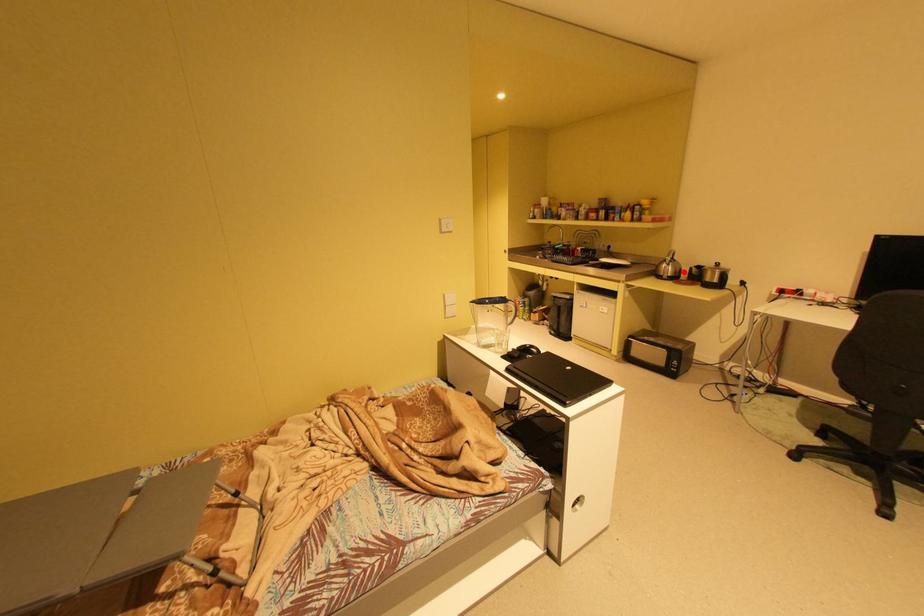
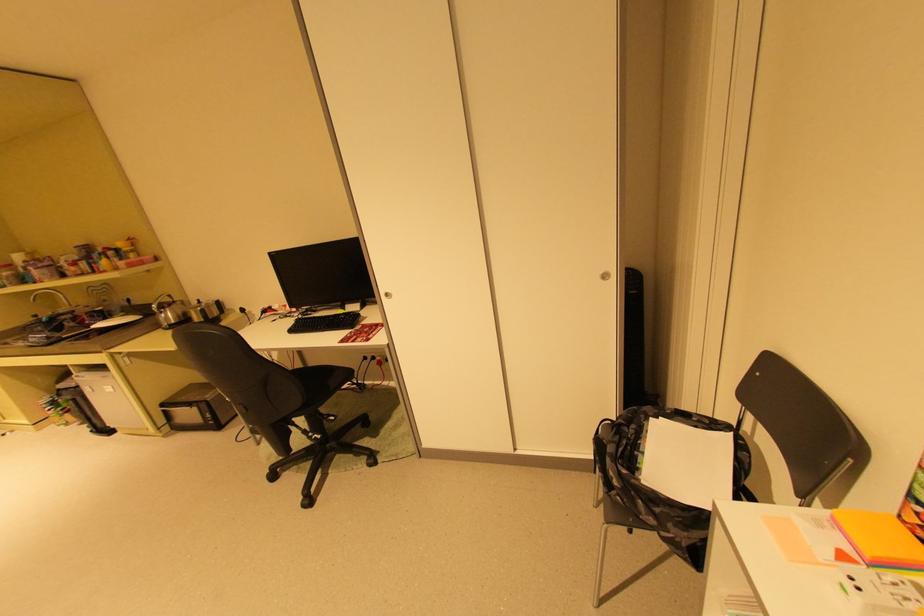
Where in the second image is the point corresponding to the highlighted location from the first image?

(187, 317)